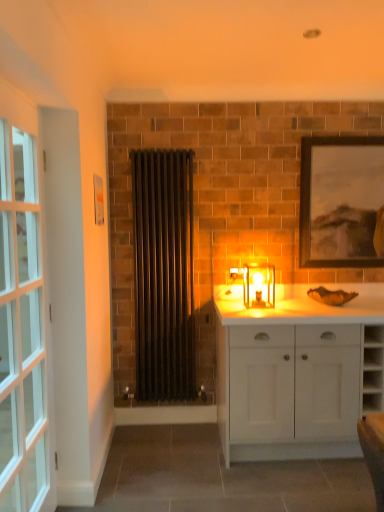
Question: Is black metal radiator at center inside wooden framed artwork at upper right?

Choices:
 (A) yes
 (B) no

Answer: (B)

Question: Can you confirm if wooden framed artwork at upper right is bigger than black metal radiator at center?

Choices:
 (A) yes
 (B) no

Answer: (B)

Question: Considering the relative sizes of wooden framed artwork at upper right and black metal radiator at center in the image provided, is wooden framed artwork at upper right smaller than black metal radiator at center?

Choices:
 (A) no
 (B) yes

Answer: (B)

Question: Can you confirm if wooden framed artwork at upper right is positioned to the left of black metal radiator at center?

Choices:
 (A) yes
 (B) no

Answer: (B)

Question: From the image's perspective, is wooden framed artwork at upper right on black metal radiator at center?

Choices:
 (A) yes
 (B) no

Answer: (A)

Question: From the image's perspective, is black metal radiator at center positioned above or below wooden framed artwork at upper right?

Choices:
 (A) above
 (B) below

Answer: (B)

Question: Would you say black metal radiator at center is to the left or to the right of wooden framed artwork at upper right in the picture?

Choices:
 (A) right
 (B) left

Answer: (B)

Question: From a real-world perspective, relative to wooden framed artwork at upper right, is black metal radiator at center vertically above or below?

Choices:
 (A) above
 (B) below

Answer: (B)

Question: Would you say black metal radiator at center is inside or outside wooden framed artwork at upper right?

Choices:
 (A) outside
 (B) inside

Answer: (A)

Question: From the image's perspective, is wooden framed artwork at upper right above or below clear glass door at left?

Choices:
 (A) below
 (B) above

Answer: (B)

Question: Is wooden framed artwork at upper right situated inside clear glass door at left or outside?

Choices:
 (A) inside
 (B) outside

Answer: (B)

Question: From a real-world perspective, is wooden framed artwork at upper right above or below clear glass door at left?

Choices:
 (A) above
 (B) below

Answer: (A)

Question: Is wooden framed artwork at upper right to the left or to the right of clear glass door at left in the image?

Choices:
 (A) right
 (B) left

Answer: (A)

Question: From a real-world perspective, is clear glass door at left positioned above or below black metal radiator at center?

Choices:
 (A) below
 (B) above

Answer: (A)

Question: Visually, is clear glass door at left positioned to the left or to the right of black metal radiator at center?

Choices:
 (A) left
 (B) right

Answer: (A)